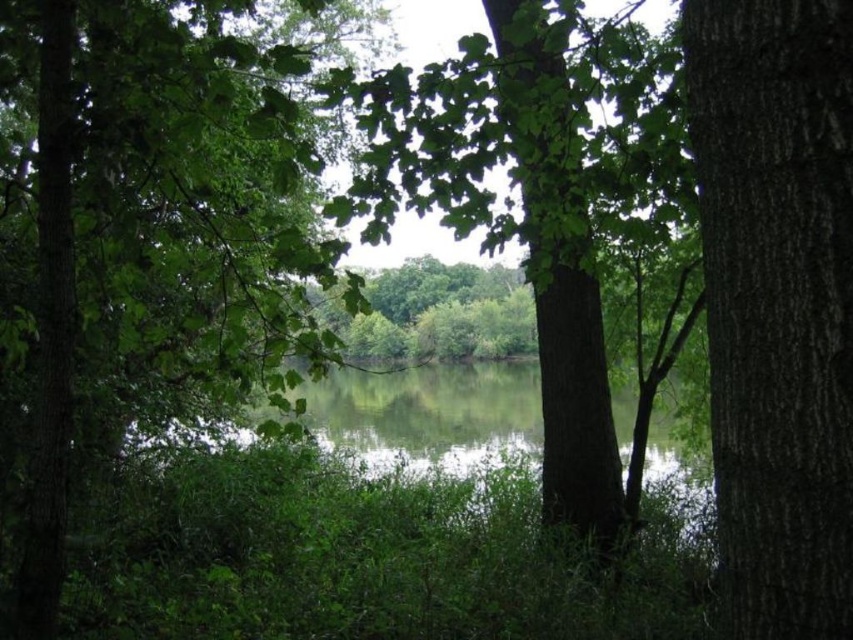
Question: Which of the following is the farthest from the observer?

Choices:
 (A) green rough bark tree at center
 (B) smooth bark tree at right
 (C) green leafy tree at center

Answer: (C)

Question: Estimate the real-world distances between objects in this image. Which object is farther from the green leafy tree at center?

Choices:
 (A) smooth bark tree at right
 (B) green rough bark tree at center

Answer: (A)

Question: Does green leafy tree at center have a smaller size compared to green rough bark tree at center?

Choices:
 (A) yes
 (B) no

Answer: (A)

Question: Which point is closer to the camera taking this photo?

Choices:
 (A) (787, 538)
 (B) (223, 120)

Answer: (A)

Question: Is green leafy tree at center thinner than smooth bark tree at right?

Choices:
 (A) yes
 (B) no

Answer: (A)

Question: Does smooth bark tree at right lie in front of green rough bark tree at center?

Choices:
 (A) yes
 (B) no

Answer: (A)